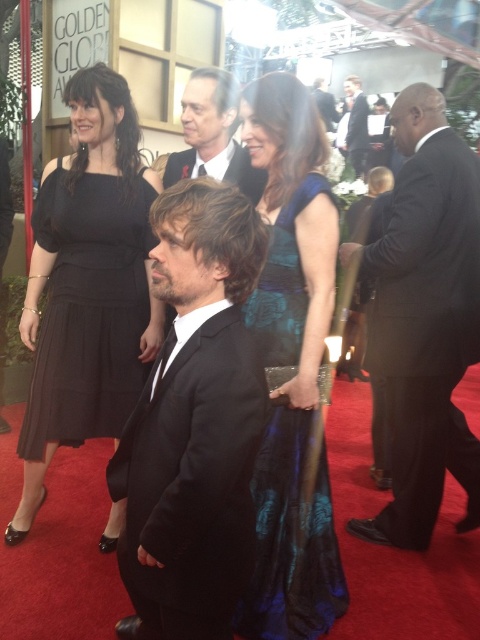
You are a photographer at the Golden Globe Awards. You need to capture a clear shot of the black satin suit at center and the black suit at center. Which one is positioned lower in the frame?

The black satin suit at center is positioned below the black suit at center, making it lower in the frame.

You are a photographer at the Golden Globe Awards. You need to position a spotlight exactly at the center of the stage, which is at point coordinates of 0.5, 0.5. The spotlight has a radius of 0.1. Will the black satin suit at center be illuminated by the spotlight?

The black satin suit at center is located at coordinates (193,422). The spotlight is centered at (240,320) with a radius of 0.1. The distance between the two points is sqrt. Since the distance is greater than 0.1, the black satin suit at center will not be illuminated by the spotlight.